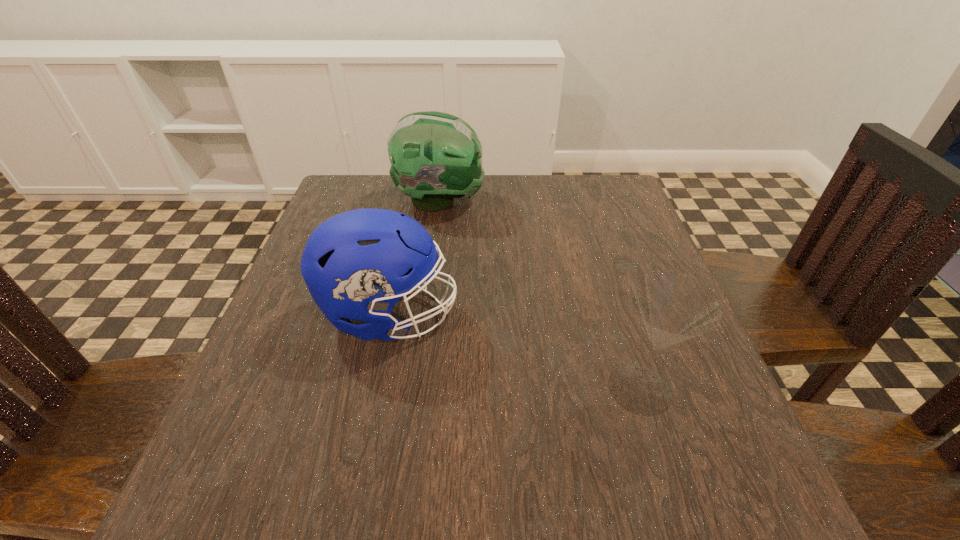
Locate an element on the screen. Image resolution: width=960 pixels, height=540 pixels. empty location between the farther football helmet and the rightmost object is located at coordinates pyautogui.click(x=540, y=295).

I want to click on unoccupied area between the second nearest object and the flute glass, so click(x=515, y=352).

Locate an element on the screen. The height and width of the screenshot is (540, 960). free space between the farther football helmet and the nearest object is located at coordinates (540, 295).

Identify the location of vacant point located between the flute glass and the farthest object. The width and height of the screenshot is (960, 540). (540, 295).

Choose which object is the nearest neighbor to the second nearest object. Please provide its 2D coordinates. Your answer should be formatted as a tuple, i.e. [(x, y)], where the tuple contains the x and y coordinates of a point satisfying the conditions above.

[(435, 157)]

Locate which object is the second closest to the second nearest object. Please provide its 2D coordinates. Your answer should be formatted as a tuple, i.e. [(x, y)], where the tuple contains the x and y coordinates of a point satisfying the conditions above.

[(672, 308)]

In order to click on vacant position in the image that satisfies the following two spatial constraints: 1. on the back side of the nearest object; 2. on the visor of the farthest object in this screenshot , I will do `click(581, 201)`.

In order to click on vacant space that satisfies the following two spatial constraints: 1. on the front-facing side of the nearer football helmet; 2. on the right side of the rightmost object in this screenshot , I will do `click(374, 388)`.

Where is `free space that satisfies the following two spatial constraints: 1. on the back side of the rightmost object; 2. on the visor of the farthest object`? The width and height of the screenshot is (960, 540). free space that satisfies the following two spatial constraints: 1. on the back side of the rightmost object; 2. on the visor of the farthest object is located at coordinates (581, 201).

Where is `vacant space that satisfies the following two spatial constraints: 1. on the front-facing side of the second nearest object; 2. on the left side of the flute glass`? vacant space that satisfies the following two spatial constraints: 1. on the front-facing side of the second nearest object; 2. on the left side of the flute glass is located at coordinates (374, 388).